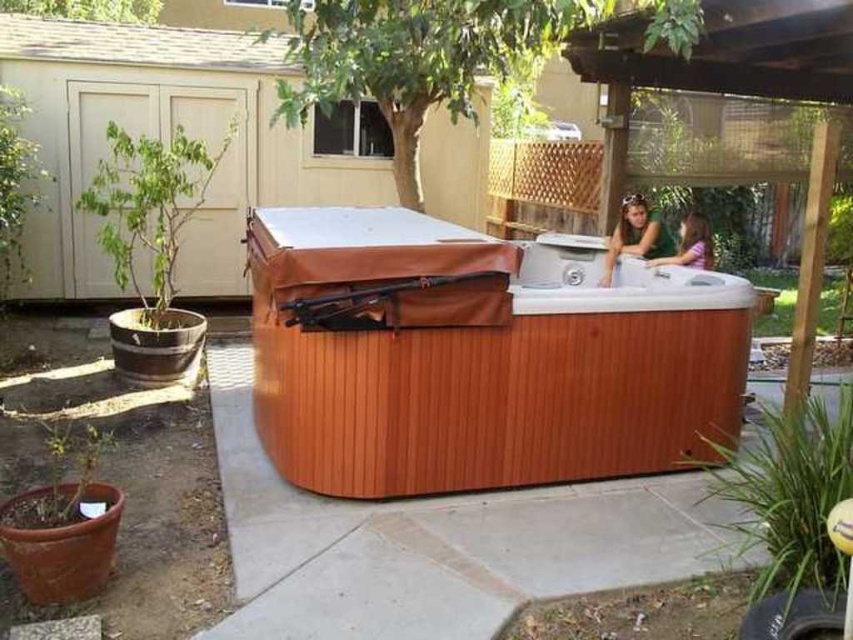
You are a guest at a backyard party and see the wooden hot tub at center and the matte brown hair at upper right. Which object takes up more space in the image?

The wooden hot tub at center is larger in size than matte brown hair at upper right, so it takes up more space in the image.

You are standing at the point marked as point (477, 356) in the backyard. What object is exactly at your current location?

The wooden hot tub at center is located at point (477, 356), so the object exactly at your current location is the wooden hot tub at center.

In the scene shown: You are planning to install a new hot tub in your backyard. You have two options shown in the image. The wooden hot tub at center and the matte brown hot tub at upper right. Which one has a larger capacity for holding water?

The wooden hot tub at center is bigger than the matte brown hot tub at upper right, so it has a larger capacity for holding water.